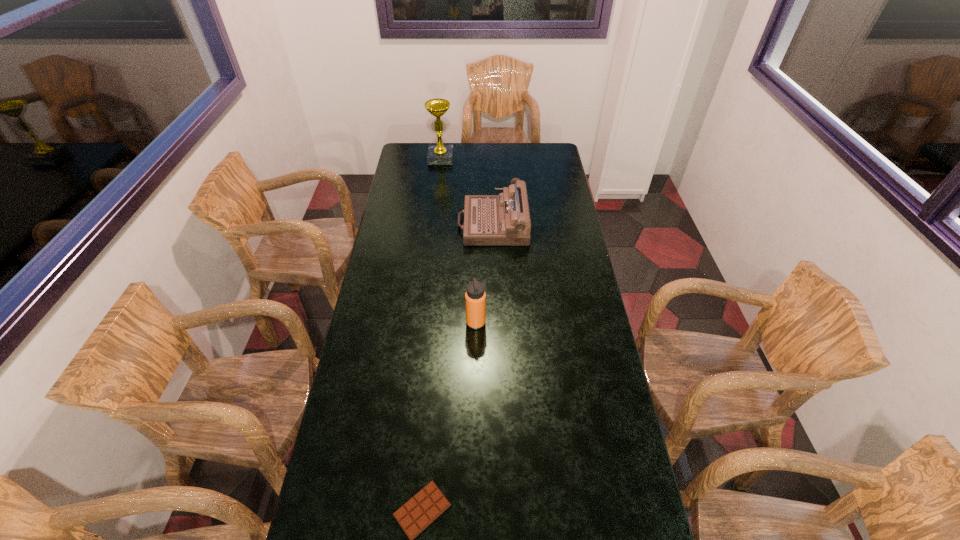
I want to click on free space between the thermos bottle and the farthest object, so click(458, 240).

Where is `empty location between the third shortest object and the typewriter`? This screenshot has width=960, height=540. empty location between the third shortest object and the typewriter is located at coordinates (484, 273).

I want to click on object that is the second closest one to the nearest object, so click(x=504, y=219).

Locate which object is the closest to the shortest object. Please provide its 2D coordinates. Your answer should be formatted as a tuple, i.e. [(x, y)], where the tuple contains the x and y coordinates of a point satisfying the conditions above.

[(475, 297)]

Image resolution: width=960 pixels, height=540 pixels. What are the coordinates of `free space that satisfies the following two spatial constraints: 1. on the front-facing side of the tallest object; 2. on the left side of the thermos bottle` in the screenshot? It's located at (421, 323).

In order to click on free space that satisfies the following two spatial constraints: 1. on the front-facing side of the tallest object; 2. on the left side of the second tallest object in this screenshot , I will do `click(421, 323)`.